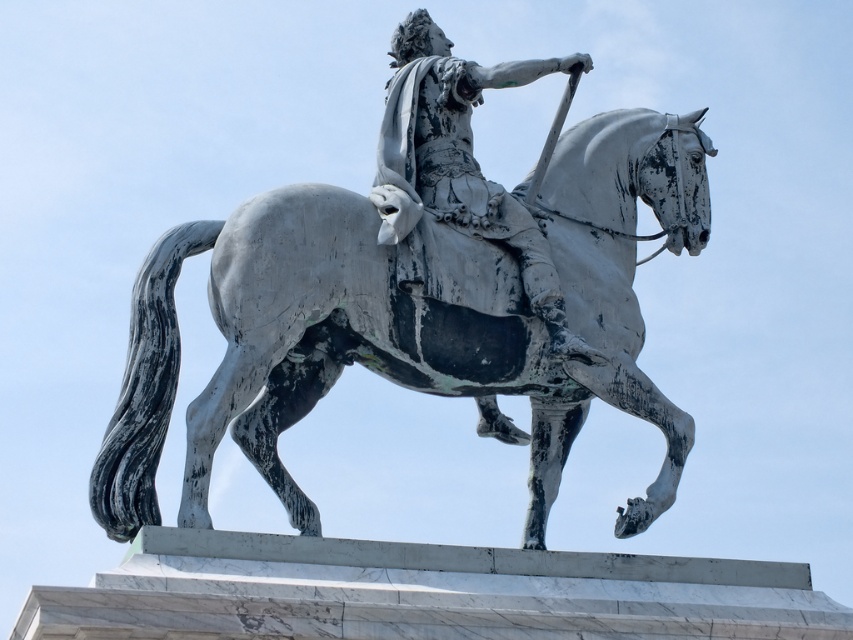
Between white weathered horse at center and bronze statue at center, which one appears on the left side from the viewer's perspective?

bronze statue at center

How far apart are white weathered horse at center and bronze statue at center?

They are 3.76 meters apart.

Is point (247, 371) closer to viewer compared to point (387, 173)?

Yes, point (247, 371) is closer to viewer.

I want to click on white weathered horse at center, so click(404, 323).